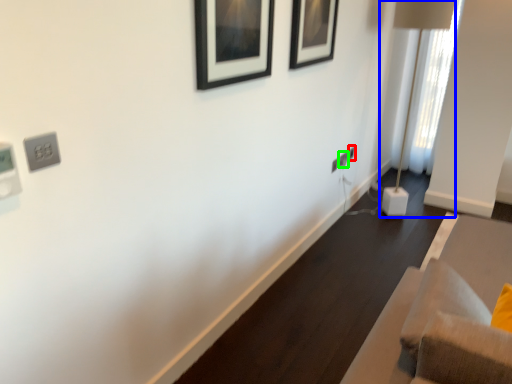
Question: Which is nearer to the electric outlet (highlighted by a red box)? table lamp (highlighted by a blue box) or electric outlet (highlighted by a green box).

Choices:
 (A) table lamp
 (B) electric outlet

Answer: (B)